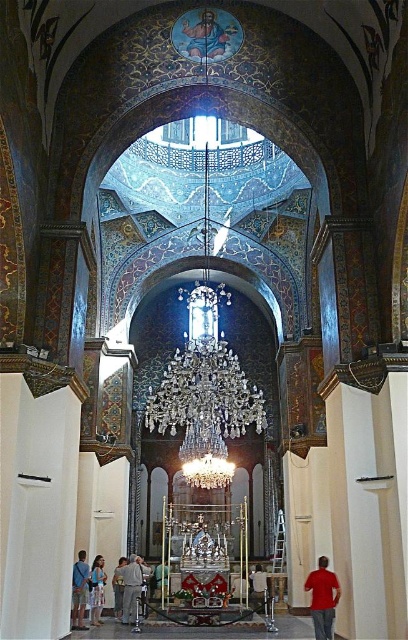
Question: Which is farther from the blue denim jeans at lower left?

Choices:
 (A) red cotton shirt at lower right
 (B) gray fabric pants at lower center
 (C) white floral dress at lower left

Answer: (A)

Question: Is blue denim jeans at lower left behind white floral dress at lower left?

Choices:
 (A) yes
 (B) no

Answer: (B)

Question: In this image, where is red cotton shirt at lower right located relative to gray fabric pants at lower center?

Choices:
 (A) above
 (B) below

Answer: (A)

Question: Which of the following is the farthest from the observer?

Choices:
 (A) [77, 592]
 (B) [117, 586]

Answer: (B)

Question: Among these objects, which one is farthest from the camera?

Choices:
 (A) light brown leather jacket at lower left
 (B) red cotton shirt at lower right

Answer: (A)

Question: Is white floral dress at lower left in front of light brown leather jacket at lower left?

Choices:
 (A) yes
 (B) no

Answer: (A)